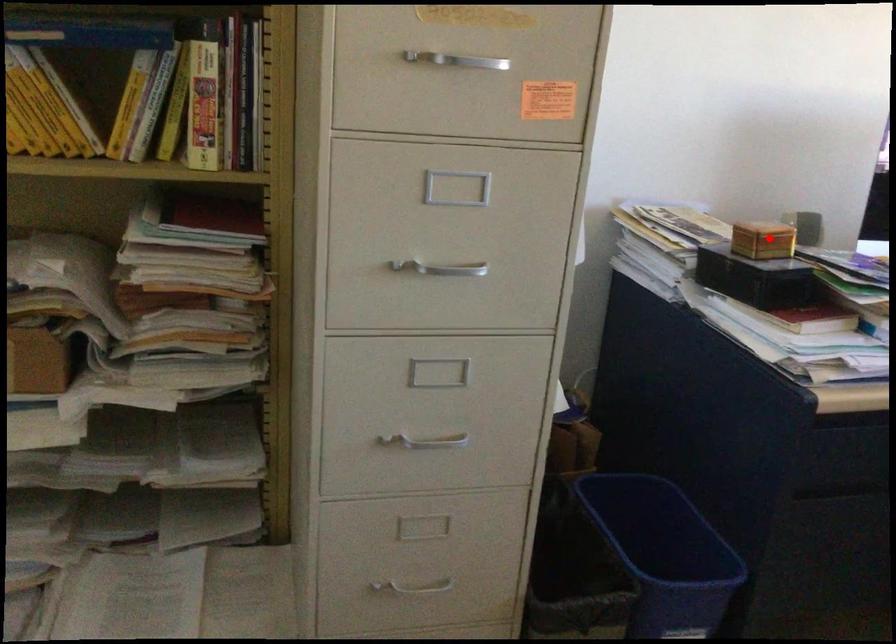
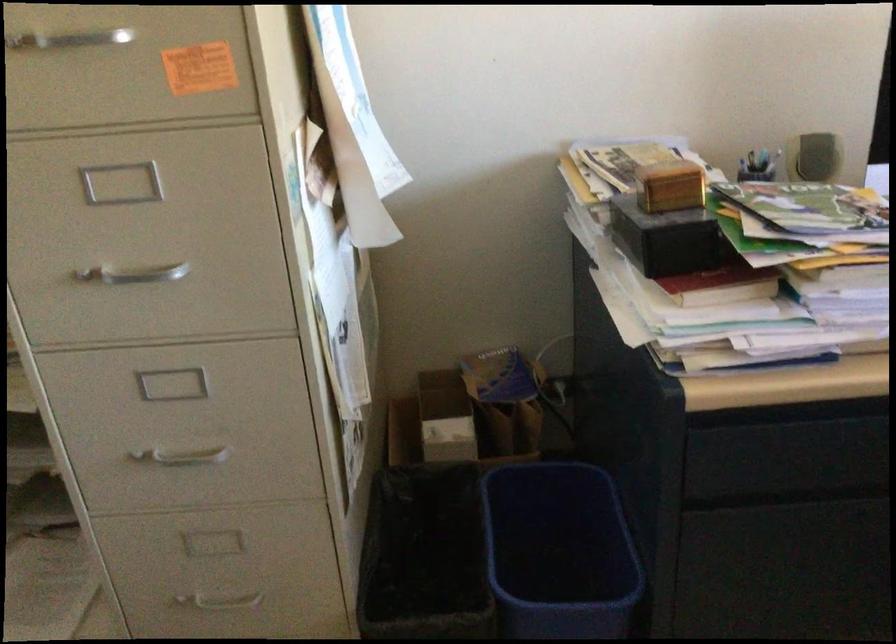
Question: I am providing you with two images of the same scene from different viewpoints. Image1 has a red point marked. In image2, the corresponding 3D location appears at what relative position? Reply with the corresponding letter.

Choices:
 (A) Closer
 (B) Farther

Answer: (A)